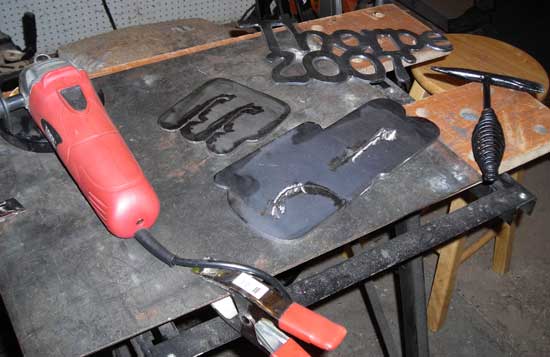
This screenshot has height=357, width=550. Identify the location of right leg of stool. (500, 266).